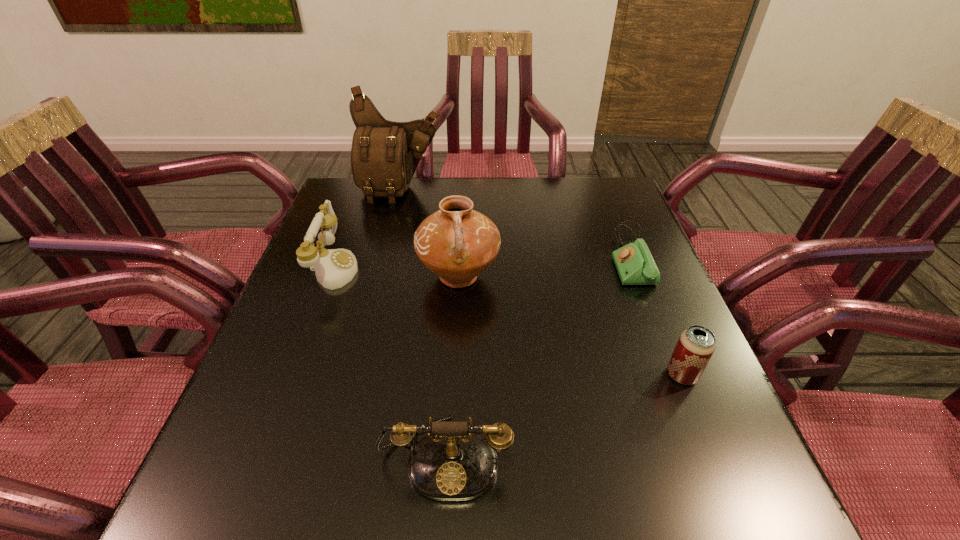
You are a GUI agent. You are given a task and a screenshot of the screen. Output one action in this format:
    pyautogui.click(x=<x>, y=<y>)
    Task: Click on the vacant space located 0.120m on the front-facing side of the tallest object
    The width and height of the screenshot is (960, 540).
    Given the screenshot: What is the action you would take?
    pyautogui.click(x=392, y=228)

Where is `free region located 0.100m on the side of the pottery with the handle`? The image size is (960, 540). free region located 0.100m on the side of the pottery with the handle is located at coordinates (456, 340).

You are a GUI agent. You are given a task and a screenshot of the screen. Output one action in this format:
    pyautogui.click(x=<x>, y=<y>)
    Task: Click on the blank space located on the dial of the leftmost telephone
    The width and height of the screenshot is (960, 540).
    Given the screenshot: What is the action you would take?
    point(455,268)

Locate an element on the screen. The image size is (960, 540). free space located 0.120m on the left of the second shortest object is located at coordinates (605, 375).

Locate an element on the screen. This screenshot has height=540, width=960. vacant point located on the dial of the shortest object is located at coordinates (458, 257).

The image size is (960, 540). Find the location of `free space located 0.250m on the dial of the shortest object`. free space located 0.250m on the dial of the shortest object is located at coordinates (513, 257).

Image resolution: width=960 pixels, height=540 pixels. I want to click on free location located 0.320m on the dial of the shortest object, so [x=486, y=257].

The width and height of the screenshot is (960, 540). Find the location of `object present at the far edge`. object present at the far edge is located at coordinates (384, 156).

The image size is (960, 540). I want to click on object positioned at the near edge, so click(452, 463).

Image resolution: width=960 pixels, height=540 pixels. In order to click on shoulder bag at the left edge in this screenshot , I will do `click(384, 156)`.